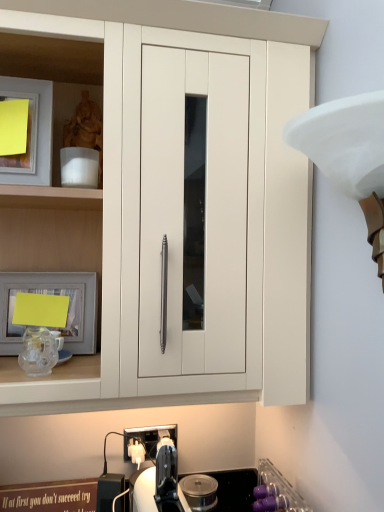
Question: Considering the positions of white matte lampshade at upper right and purple plastic cups at lower right in the image, is white matte lampshade at upper right taller or shorter than purple plastic cups at lower right?

Choices:
 (A) short
 (B) tall

Answer: (B)

Question: Does point (331, 180) appear closer or farther from the camera than point (266, 485)?

Choices:
 (A) closer
 (B) farther

Answer: (A)

Question: Which of these objects is positioned closest to the white plastic electric outlet at lower center?

Choices:
 (A) matte silver picture frame at left
 (B) purple plastic cups at lower right
 (C) matte white cabinet at center
 (D) white matte lampshade at upper right

Answer: (B)

Question: Which of these objects is positioned closest to the matte silver picture frame at left?

Choices:
 (A) white matte lampshade at upper right
 (B) purple plastic cups at lower right
 (C) matte white cabinet at center
 (D) white plastic electric outlet at lower center

Answer: (C)